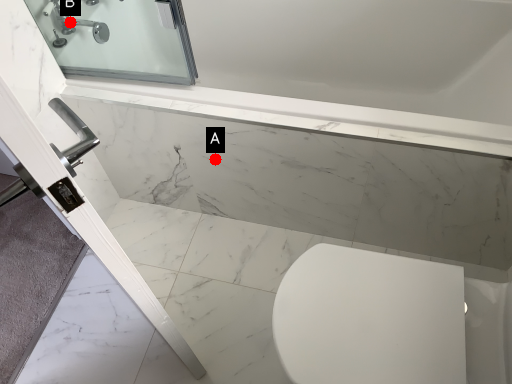
Question: Two points are circled on the image, labeled by A and B beside each circle. Which point is closer to the camera?

Choices:
 (A) A is closer
 (B) B is closer

Answer: (A)